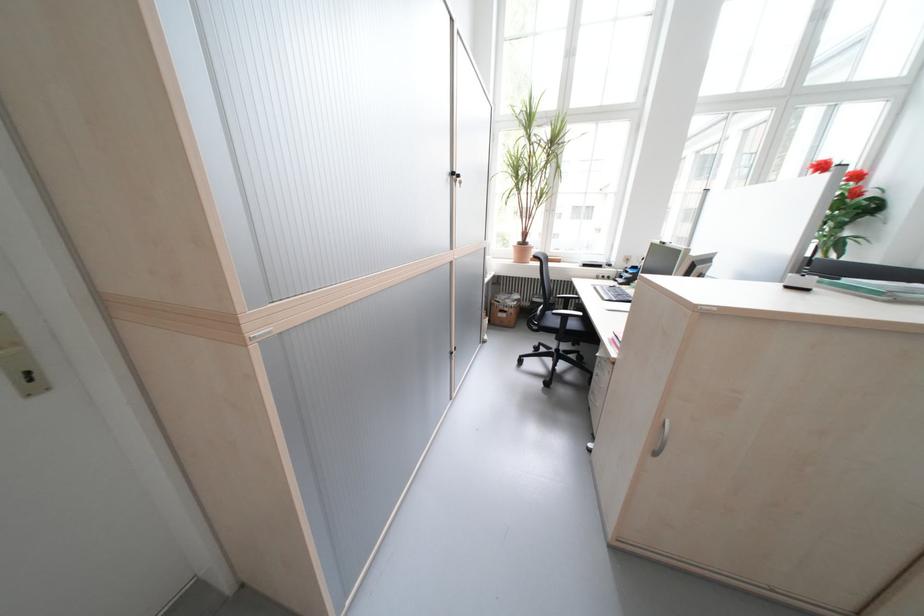
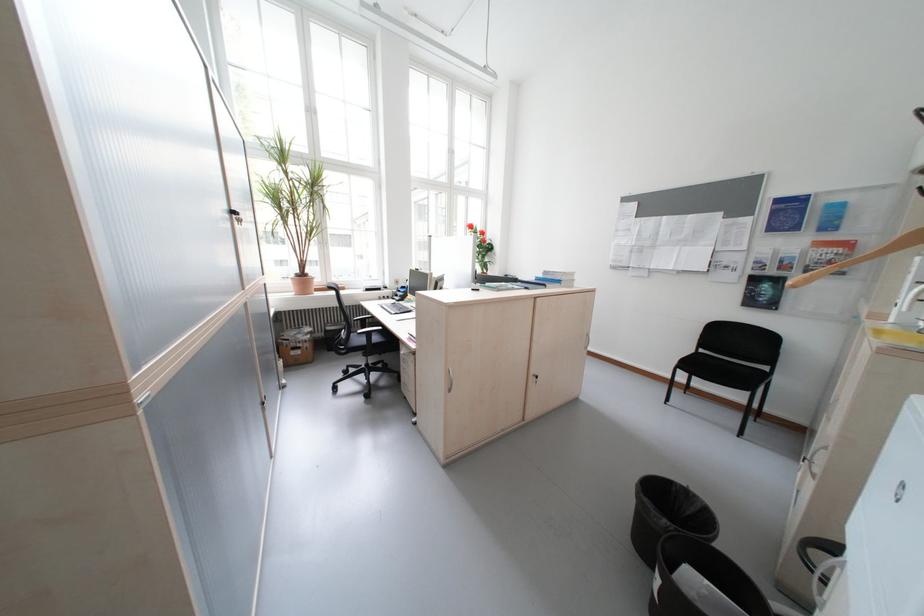
Locate, in the second image, the point that corresponds to point (575, 318) in the first image.

(380, 334)